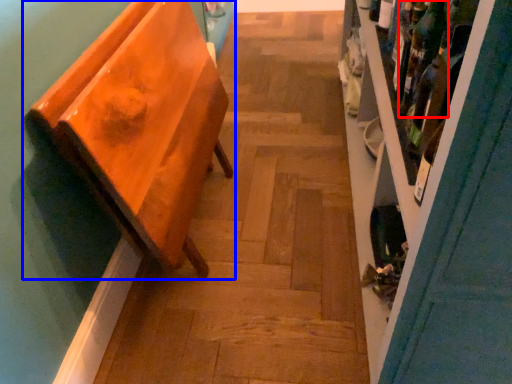
Question: Which of the following is the closest to the observer, wine bottle (highlighted by a red box) or furniture (highlighted by a blue box)?

Choices:
 (A) wine bottle
 (B) furniture

Answer: (B)